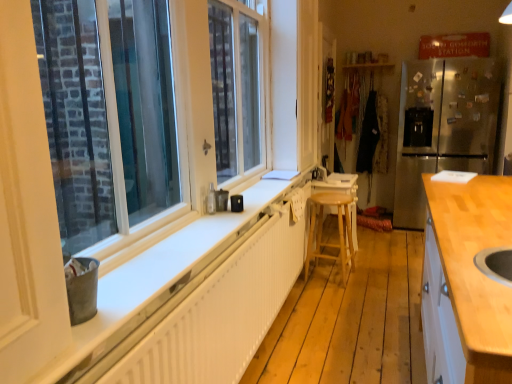
Question: Considering the relative positions of light brown wooden stool at center and wooden stool at center in the image provided, is light brown wooden stool at center to the right of wooden stool at center from the viewer's perspective?

Choices:
 (A) no
 (B) yes

Answer: (A)

Question: Is light brown wooden stool at center facing away from wooden stool at center?

Choices:
 (A) yes
 (B) no

Answer: (B)

Question: Is light brown wooden stool at center completely or partially outside of wooden stool at center?

Choices:
 (A) yes
 (B) no

Answer: (A)

Question: Is light brown wooden stool at center surrounding wooden stool at center?

Choices:
 (A) yes
 (B) no

Answer: (B)

Question: Does light brown wooden stool at center lie behind wooden stool at center?

Choices:
 (A) yes
 (B) no

Answer: (B)

Question: Is light brown wooden stool at center at the left side of wooden stool at center?

Choices:
 (A) yes
 (B) no

Answer: (A)

Question: Does wooden stool at center have a lesser height compared to brushed metal faucet at center?

Choices:
 (A) no
 (B) yes

Answer: (A)

Question: Is wooden stool at center aimed at brushed metal faucet at center?

Choices:
 (A) no
 (B) yes

Answer: (A)

Question: From a real-world perspective, is wooden stool at center positioned over brushed metal faucet at center based on gravity?

Choices:
 (A) yes
 (B) no

Answer: (B)

Question: Is wooden stool at center thinner than brushed metal faucet at center?

Choices:
 (A) no
 (B) yes

Answer: (A)

Question: Would you say wooden stool at center is a long distance from brushed metal faucet at center?

Choices:
 (A) yes
 (B) no

Answer: (B)

Question: From the image's perspective, is wooden stool at center over brushed metal faucet at center?

Choices:
 (A) yes
 (B) no

Answer: (B)

Question: Can you confirm if light wood countertop at right is positioned to the right of brushed metal faucet at center?

Choices:
 (A) no
 (B) yes

Answer: (B)